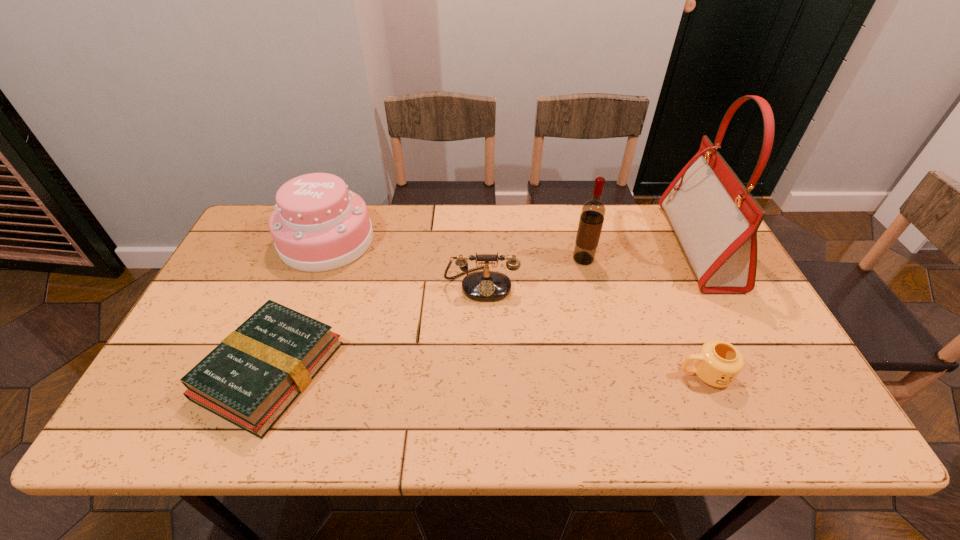
This screenshot has height=540, width=960. I want to click on object that is at the near edge, so click(x=250, y=379).

You are a GUI agent. You are given a task and a screenshot of the screen. Output one action in this format:
    pyautogui.click(x=<x>, y=<y>)
    Task: Click on the birthday cake positioned at the left edge
    
    Given the screenshot: What is the action you would take?
    pyautogui.click(x=318, y=225)

At what (x,y) coordinates should I click in order to perform the action: click on hardback book that is at the left edge. Please return your answer as a coordinate pair (x, y). The image size is (960, 540). Looking at the image, I should click on (250, 379).

Locate an element on the screen. handbag at the right edge is located at coordinates (715, 218).

The height and width of the screenshot is (540, 960). I want to click on mug located in the right edge section of the desktop, so click(718, 363).

Where is `object that is at the far left corner`? object that is at the far left corner is located at coordinates (318, 225).

Locate an element on the screen. This screenshot has height=540, width=960. object positioned at the near left corner is located at coordinates (250, 379).

Locate an element on the screen. object located at the far right corner is located at coordinates (715, 218).

I want to click on free space at the far edge of the desktop, so coord(483,214).

In the image, there is a desktop. Identify the location of free region at the near edge. The width and height of the screenshot is (960, 540). (416, 427).